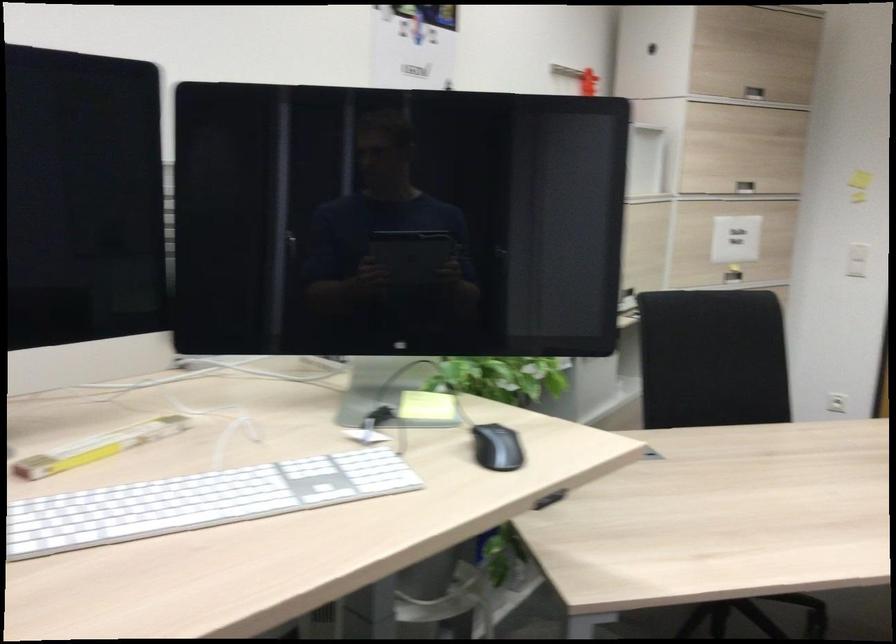
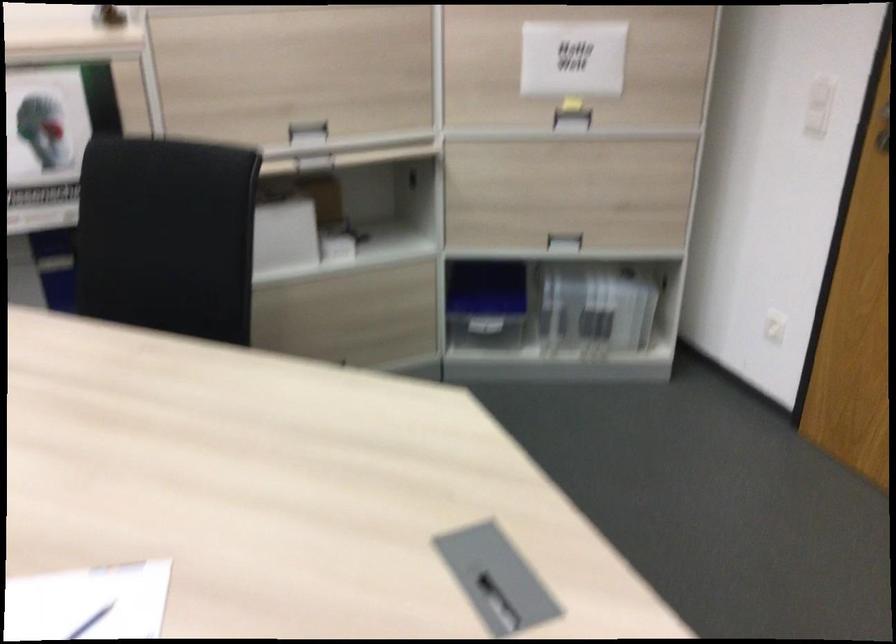
The point at (625, 386) is marked in the first image. Where is the corresponding point in the second image?

(337, 247)